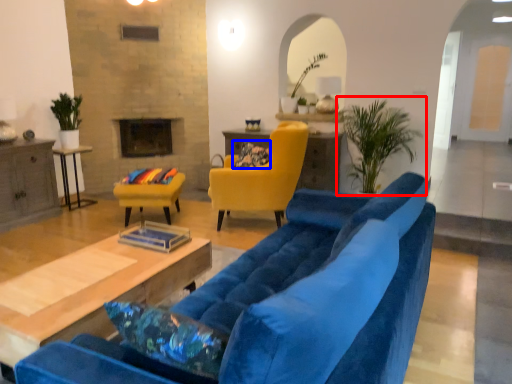
Question: Which of the following is the closest to the observer, houseplant (highlighted by a red box) or pillow (highlighted by a blue box)?

Choices:
 (A) houseplant
 (B) pillow

Answer: (A)